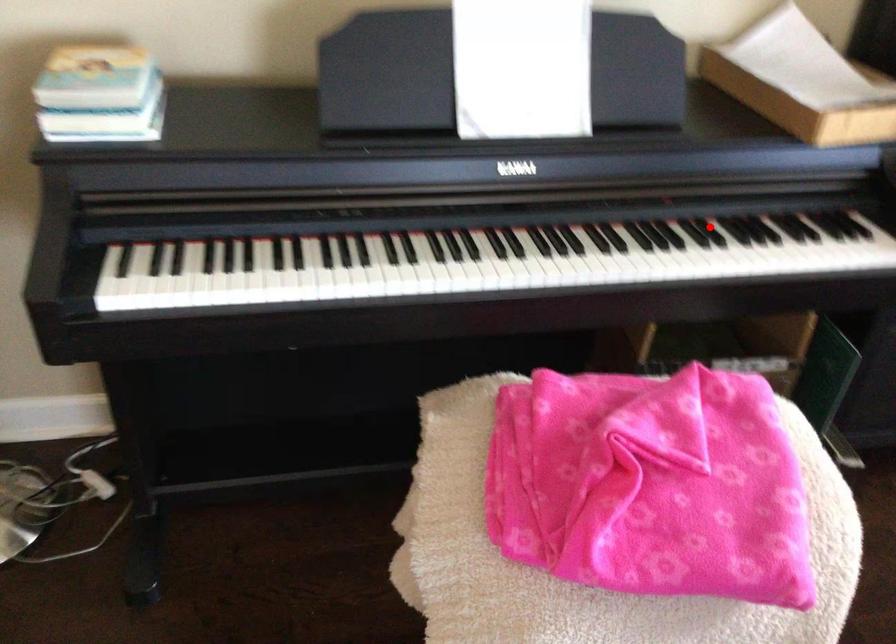
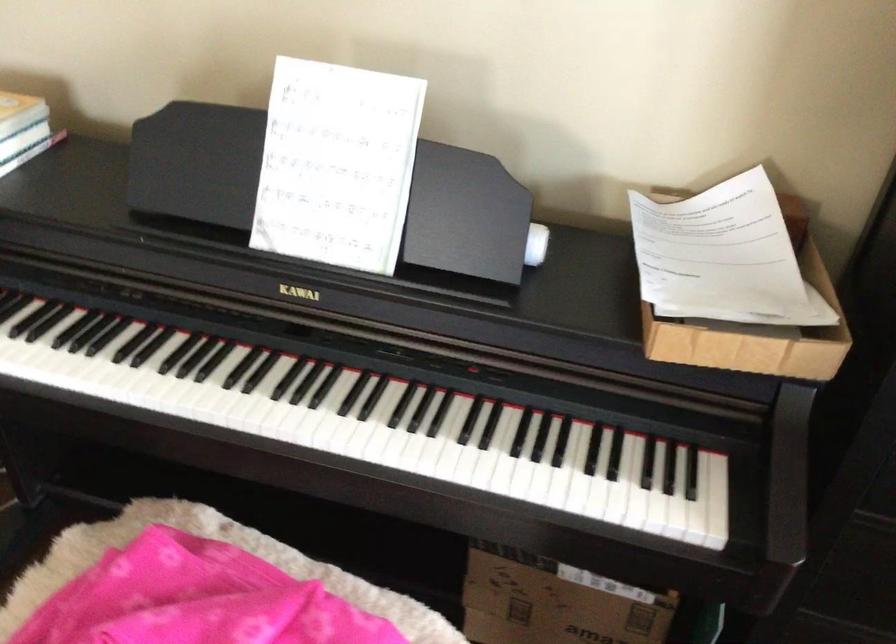
Find the pixel in the second image that matches the highlighted location in the first image.

(489, 424)